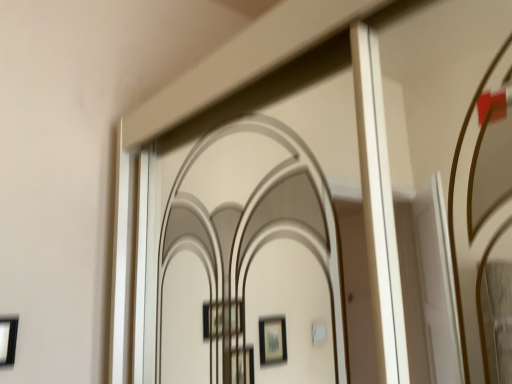
The width and height of the screenshot is (512, 384). Find the location of `matte black picture frame at lower left`. matte black picture frame at lower left is located at coordinates (8, 340).

Describe the element at coordinates (8, 340) in the screenshot. Image resolution: width=512 pixels, height=384 pixels. I see `matte black picture frame at lower left` at that location.

Locate an element on the screen. matte black picture frame at lower left is located at coordinates (8, 340).